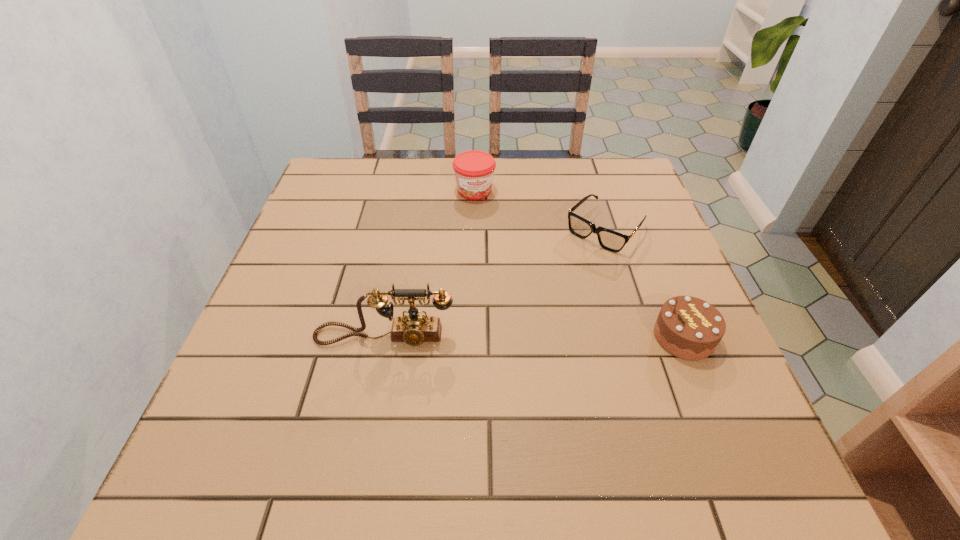
Where is `free space on the desktop that is between the telephone and the chocolate cake and is positioned on the label side of the farthest object`? free space on the desktop that is between the telephone and the chocolate cake and is positioned on the label side of the farthest object is located at coordinates (530, 336).

The image size is (960, 540). In order to click on free space on the desktop that is between the tallest object and the chocolate cake and is positioned on the front-facing side of the second farthest object in this screenshot , I will do pos(504,336).